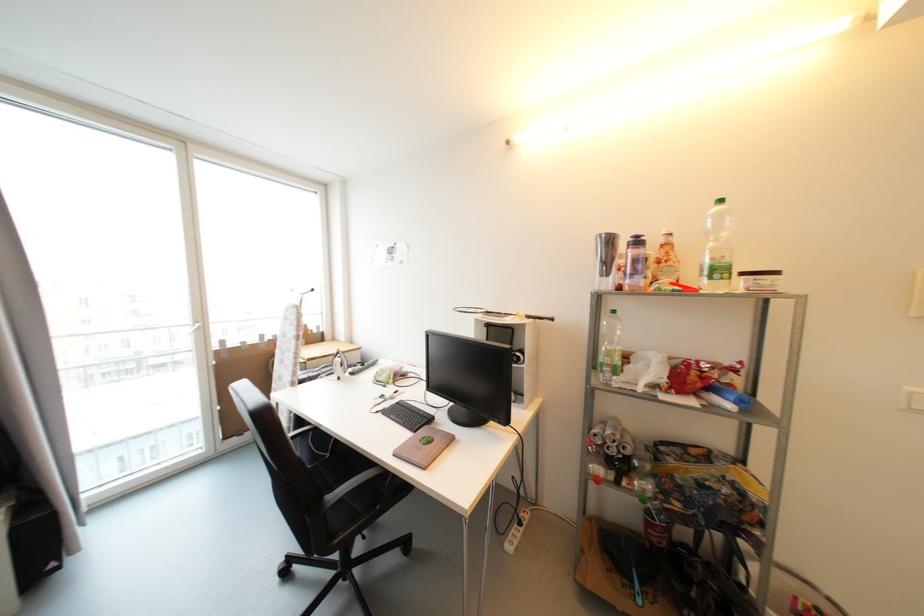
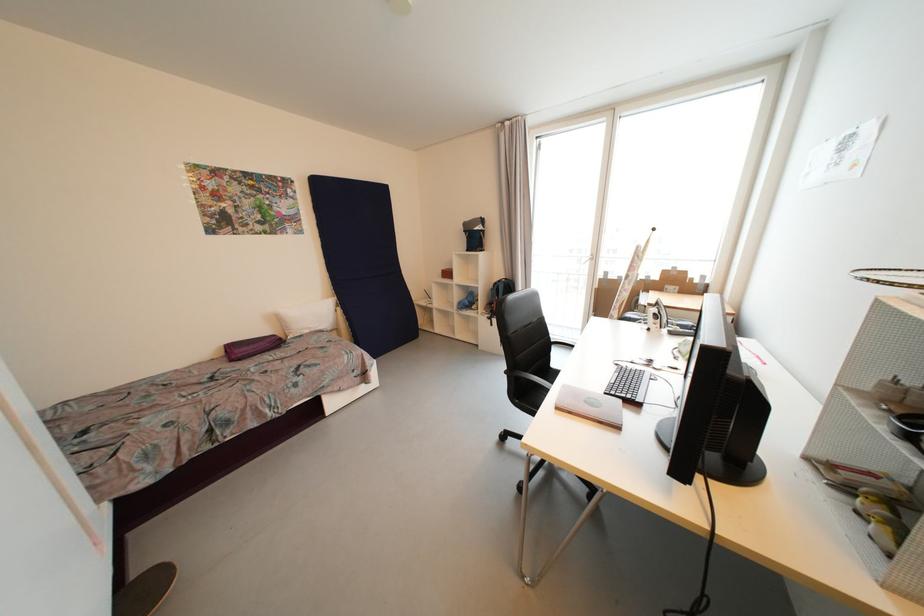
Locate, in the second image, the point that corresponds to pixel 346 367 in the first image.

(662, 318)